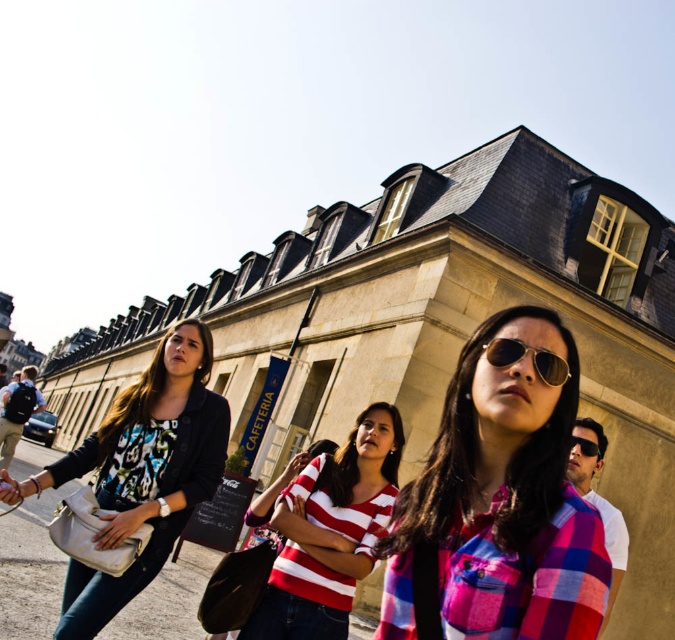
Consider the image. You are a tailor trying to determine which garment to adjust first. Based on the scene, which item is taller between the matte black jacket at center and the striped cotton shirt at center?

The matte black jacket at center is much taller than the striped cotton shirt at center, so you should adjust the matte black jacket at center first.